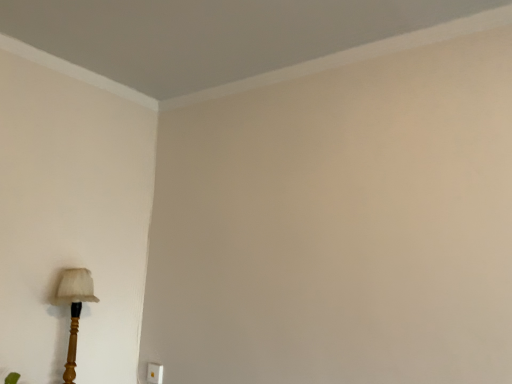
Question: Does point (69, 294) appear closer or farther from the camera than point (156, 364)?

Choices:
 (A) farther
 (B) closer

Answer: (B)

Question: From a real-world perspective, is wooden lampshade at lower left positioned above or below white plastic electric outlet at lower left?

Choices:
 (A) above
 (B) below

Answer: (A)

Question: From the image's perspective, is wooden lampshade at lower left positioned above or below white plastic electric outlet at lower left?

Choices:
 (A) above
 (B) below

Answer: (A)

Question: Do you think white plastic electric outlet at lower left is within wooden lampshade at lower left, or outside of it?

Choices:
 (A) inside
 (B) outside

Answer: (B)

Question: From the image's perspective, is white plastic electric outlet at lower left located above or below wooden lampshade at lower left?

Choices:
 (A) above
 (B) below

Answer: (B)

Question: Is white plastic electric outlet at lower left to the left or to the right of wooden lampshade at lower left in the image?

Choices:
 (A) right
 (B) left

Answer: (A)

Question: From a real-world perspective, relative to wooden lampshade at lower left, is white plastic electric outlet at lower left vertically above or below?

Choices:
 (A) below
 (B) above

Answer: (A)